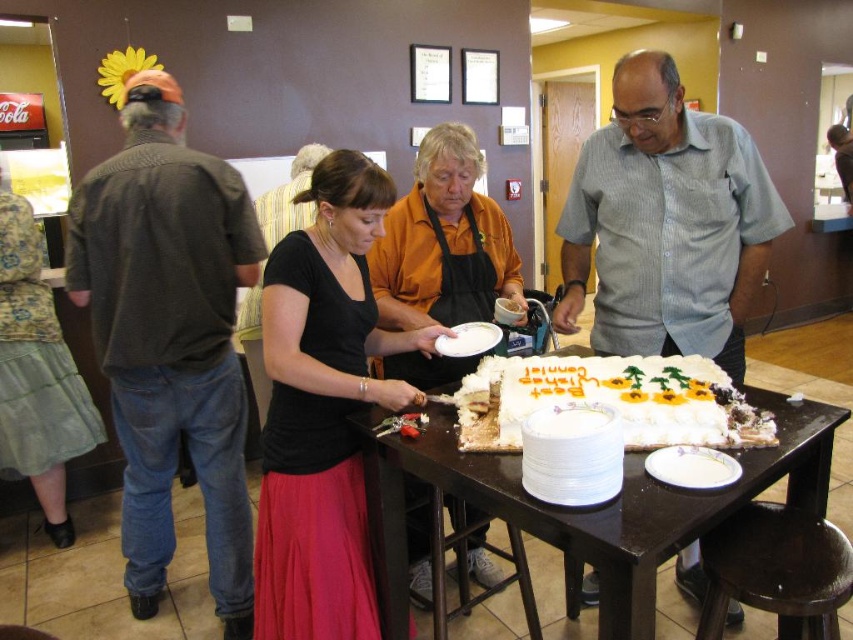
You are a guest at the celebration and want to grab a plate from the table. You notice the black matte shirt at center and the white ceramic plate at lower center. Which object is positioned to the left of the other?

The black matte shirt at center is to the left of the white ceramic plate at lower center.

Looking at this image, you are at a birthday party and see the gray striped shirt at center and the white frosted cake at center. Which object is positioned to the right of the other?

The gray striped shirt at center is to the right of the white frosted cake at center.